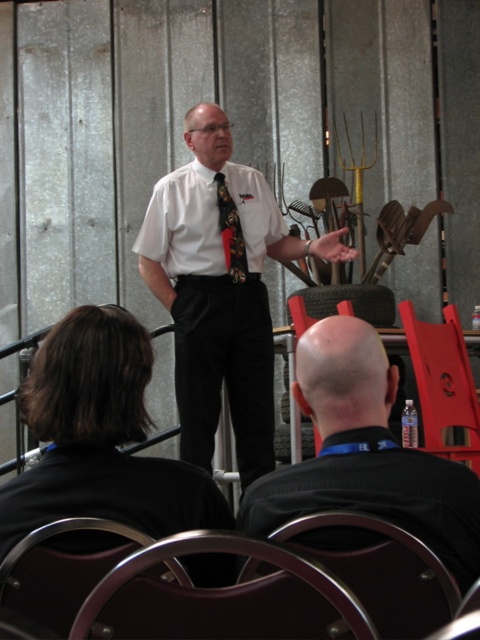
You are an attendee sitting in the conference room and want to determine which of the two points, point (248, 429) or point (425, 419), is closer to you. Based on the scene description, which point is nearer?

Point (248, 429) is further to the viewer than point (425, 419). Wait, no, the description says the opposite. Let me check again. The Objects Description states that point (248, 429) is further to the viewer than point (425, 419). Hmm, so if the question is asking which is closer to the attendee, then the point that is further to the viewer would actually be farther away from the attendee. Wait, maybe I need to clarify. The description says point A is further to the viewer than point B. So point A,

You are attending a presentation in the conference room. The speaker is wearing a white shirt at center and a black satin tie at center. Which clothing item is higher up on his body?

The white shirt at center is taller than the black satin tie at center, so the white shirt at center is higher up on the speaker.

You are an attendee in the conference room. You notice the speaker wearing a white shirt at center and a black satin tie at center. Which clothing item is located to the right when facing the speaker?

The white shirt at center is positioned on the right side of the black satin tie at center, so the white shirt at center is to the right when facing the speaker.